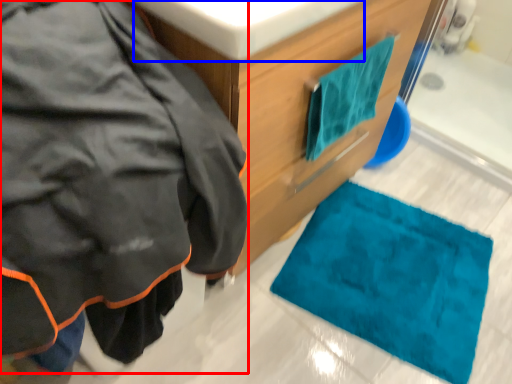
Question: Which point is further to the camera, jacket (highlighted by a red box) or sink (highlighted by a blue box)?

Choices:
 (A) jacket
 (B) sink

Answer: (B)